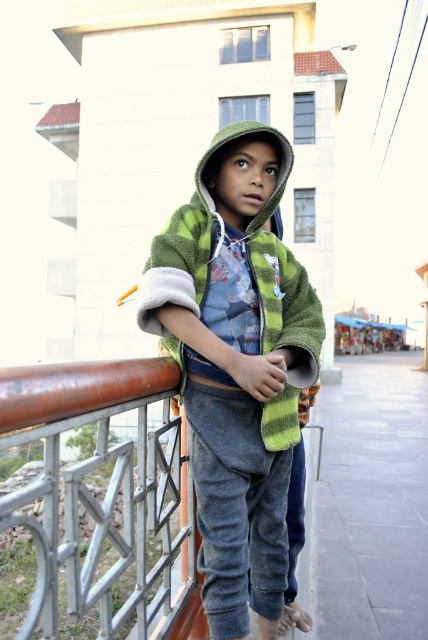
Question: Considering the relative positions of rusty metal fence at left and green fuzzy jacket at center in the image provided, where is rusty metal fence at left located with respect to green fuzzy jacket at center?

Choices:
 (A) below
 (B) above

Answer: (A)

Question: Which of the following is the closest to the observer?

Choices:
 (A) rusty metal fence at left
 (B) green fuzzy jacket at center

Answer: (A)

Question: Does rusty metal fence at left have a smaller size compared to green fuzzy jacket at center?

Choices:
 (A) yes
 (B) no

Answer: (B)

Question: Which point is closer to the camera?

Choices:
 (A) (17, 435)
 (B) (264, 422)

Answer: (A)

Question: Can you confirm if rusty metal fence at left is thinner than green fuzzy jacket at center?

Choices:
 (A) no
 (B) yes

Answer: (A)